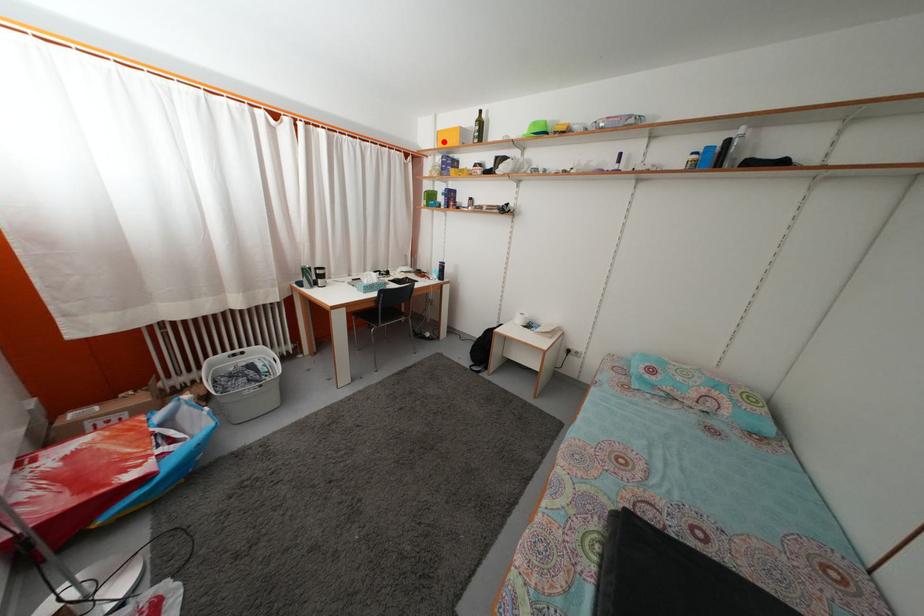
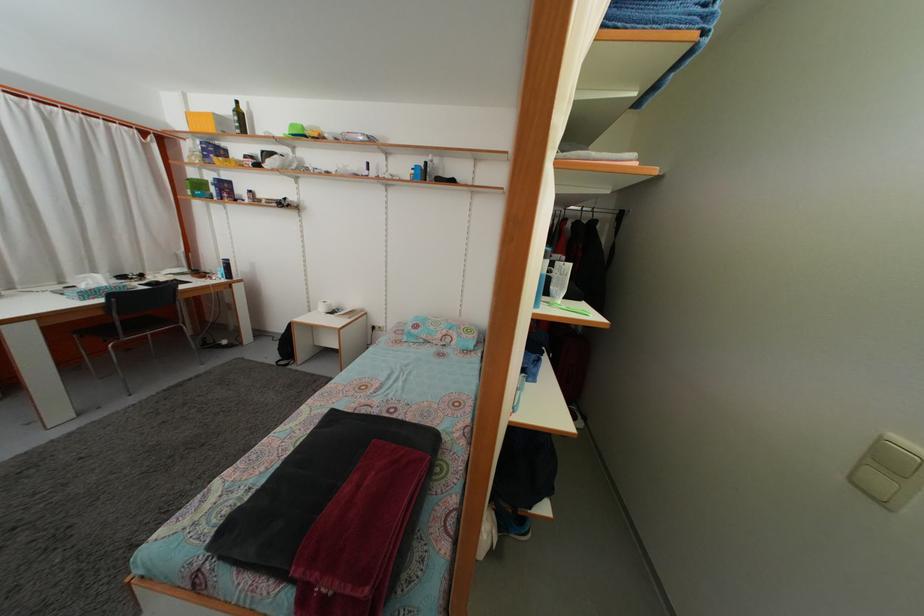
The point at the highlighted location is marked in the first image. Where is the corresponding point in the second image?

(196, 123)